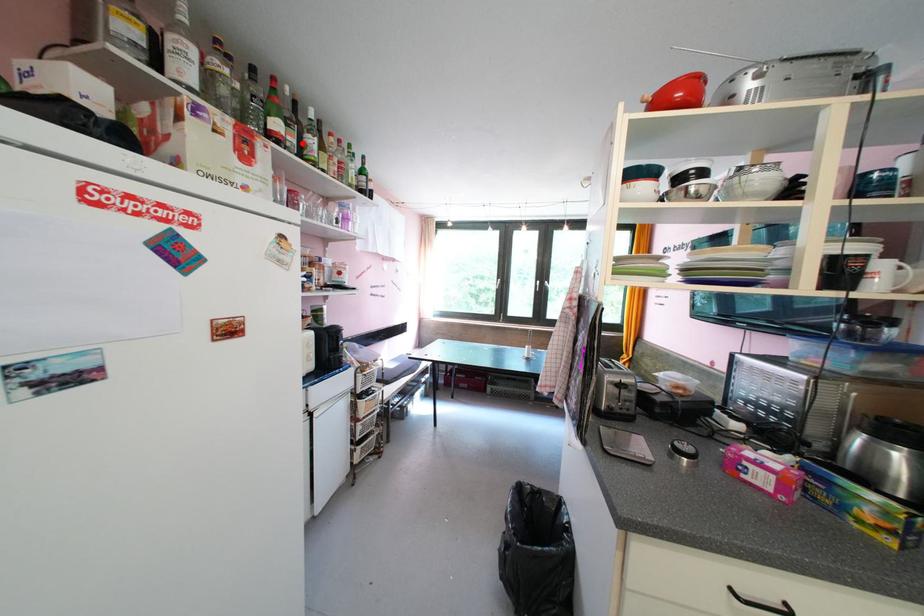
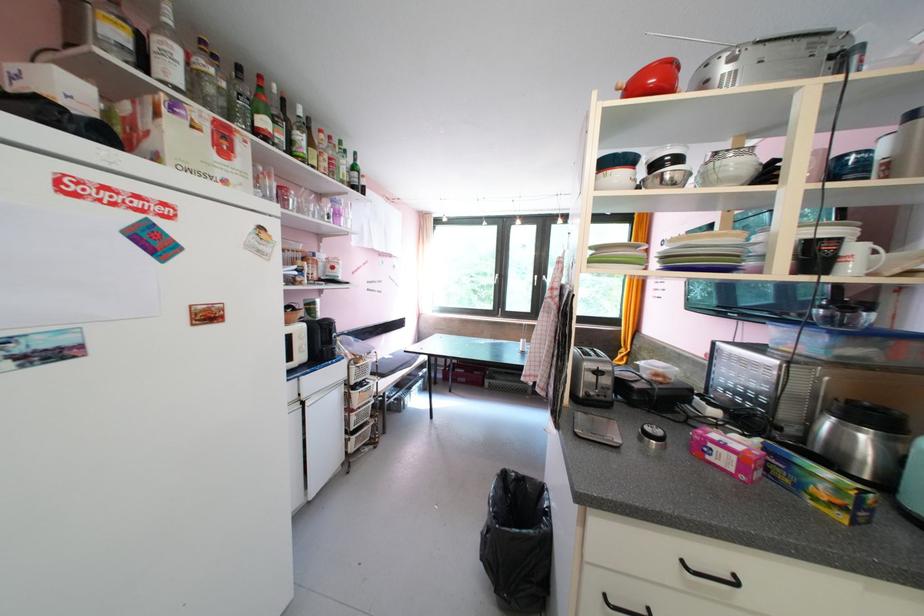
Question: I am providing you with two images of the same scene from different viewpoints. A red point is marked on the first image. Can you still see the location of the red point in image 2?

Choices:
 (A) Yes
 (B) No

Answer: (A)